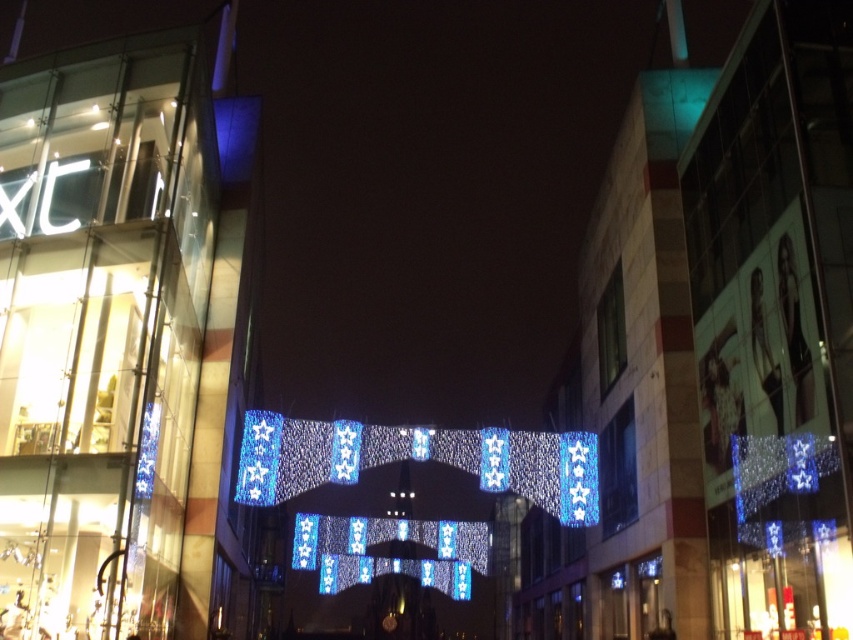
Question: Can you confirm if blue glass building at center is positioned below translucent glass mall at center?

Choices:
 (A) no
 (B) yes

Answer: (B)

Question: Does blue glass building at center have a larger size compared to translucent glass mall at center?

Choices:
 (A) no
 (B) yes

Answer: (B)

Question: Which object is farther from the camera taking this photo?

Choices:
 (A) blue glass building at center
 (B) translucent glass mall at center

Answer: (B)

Question: Can you confirm if blue glass building at center is positioned below translucent glass mall at center?

Choices:
 (A) yes
 (B) no

Answer: (A)

Question: Which point is closer to the camera?

Choices:
 (A) translucent glass mall at center
 (B) blue glass building at center

Answer: (B)